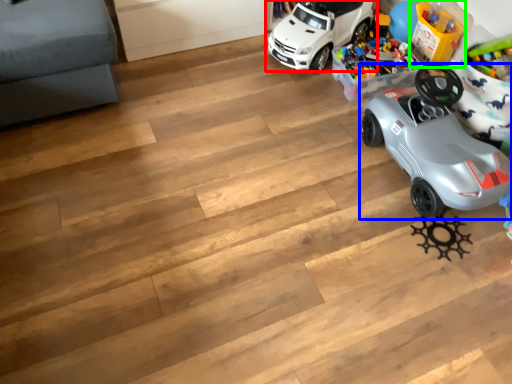
Question: Which object is positioned farthest from car (highlighted by a red box)? Select from car (highlighted by a blue box) and toy (highlighted by a green box).

Choices:
 (A) car
 (B) toy

Answer: (A)